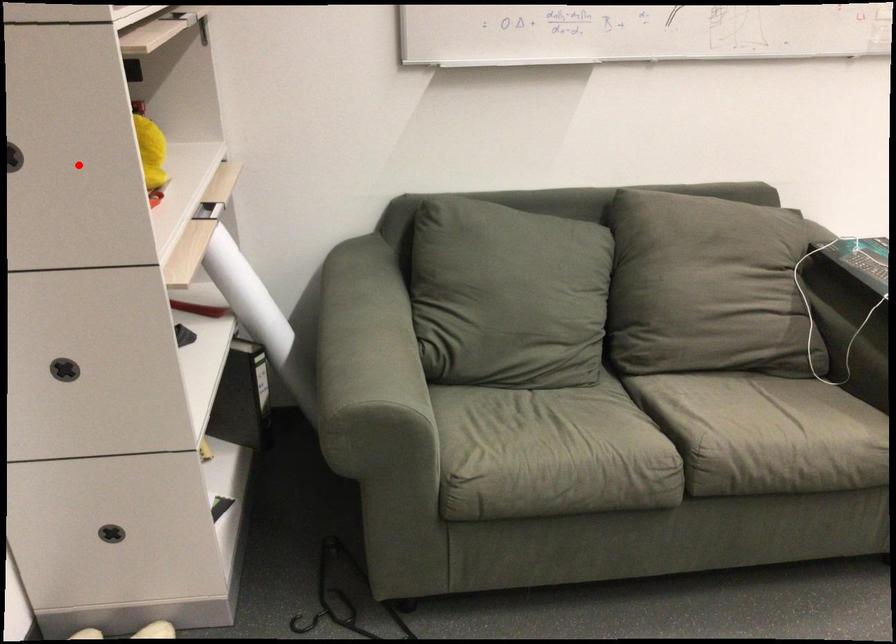
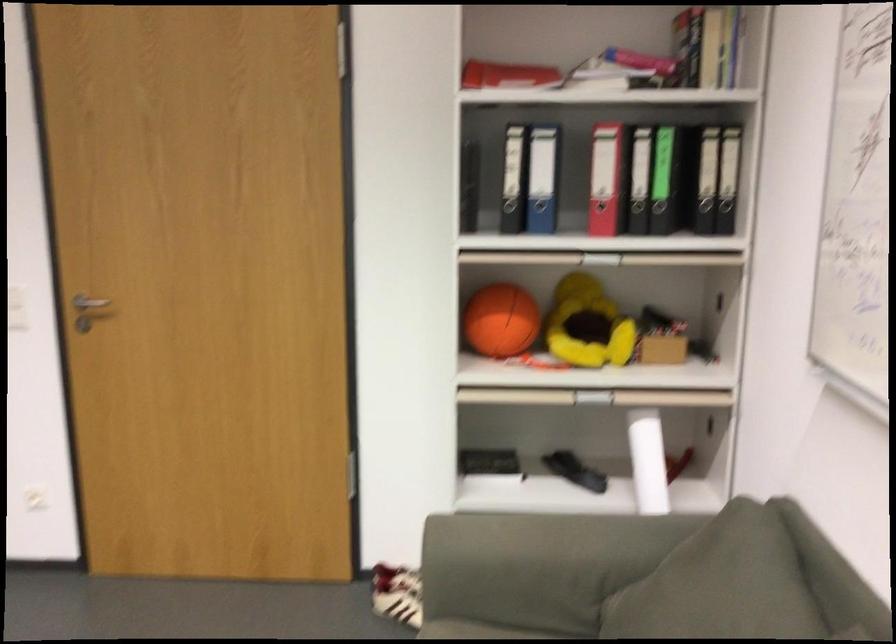
Question: A red point is marked in image1. In image2, is the corresponding 3D point closer to the camera or farther? Reply with the corresponding letter.

Choices:
 (A) The corresponding 3D point is closer.
 (B) The corresponding 3D point is farther.

Answer: (B)